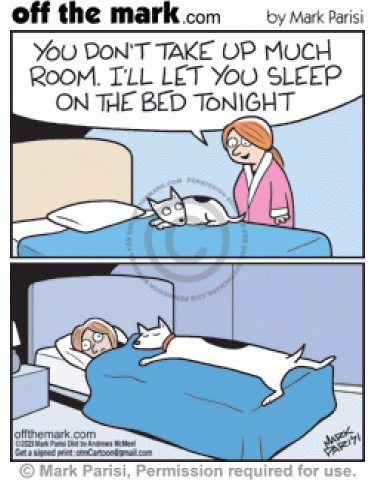
This screenshot has width=380, height=480. In order to click on corners of lower panel in this screenshot , I will do `click(365, 459)`, `click(11, 460)`, `click(9, 261)`, `click(364, 265)`.